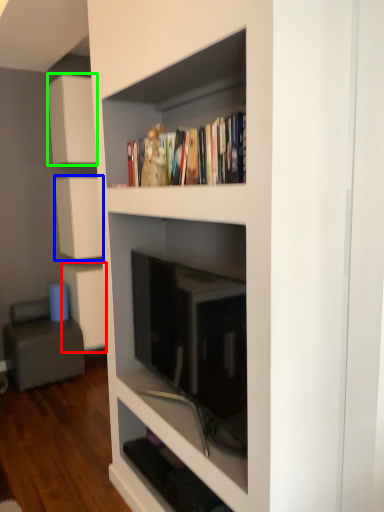
Question: Estimate the real-world distances between objects in this image. Which object is closer to cabinetry (highlighted by a red box), cabinetry (highlighted by a blue box) or cabinetry (highlighted by a green box)?

Choices:
 (A) cabinetry
 (B) cabinetry

Answer: (A)